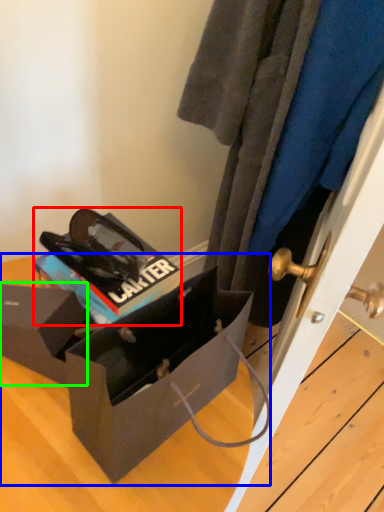
Question: Estimate the real-world distances between objects in this image. Which object is farther from kit (highlighted by a red box), box (highlighted by a blue box) or box (highlighted by a green box)?

Choices:
 (A) box
 (B) box

Answer: (A)